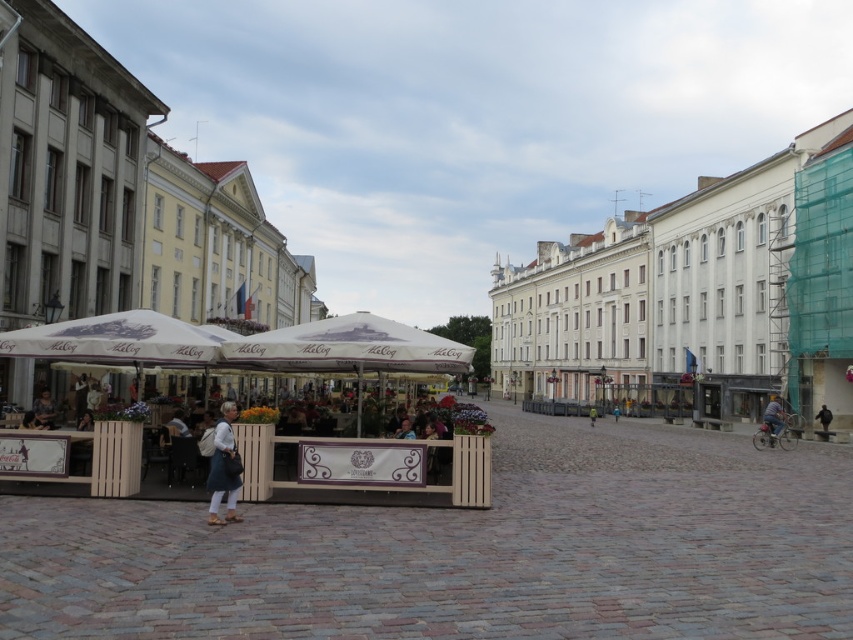
Can you confirm if white wood market at center is thinner than light blue denim jacket at lower left?

Incorrect, white wood market at center's width is not less than light blue denim jacket at lower left's.

Can you confirm if white wood market at center is positioned above light blue denim jacket at lower left?

Indeed, white wood market at center is positioned over light blue denim jacket at lower left.

Between point (416, 346) and point (227, 470), which one is positioned in front?

Point (227, 470) is more forward.

Locate an element on the screen. white wood market at center is located at coordinates (241, 344).

Between blue denim jeans at lower right and green fabric jacket at center, which one appears on the right side from the viewer's perspective?

blue denim jeans at lower right is more to the right.

Is blue denim jeans at lower right to the right of green fabric jacket at center from the viewer's perspective?

Correct, you'll find blue denim jeans at lower right to the right of green fabric jacket at center.

Between point (782, 417) and point (592, 422), which one is positioned behind?

The point (592, 422) is behind.

Locate an element on the screen. This screenshot has height=640, width=853. blue denim jeans at lower right is located at coordinates (773, 419).

Consider the image. Who is shorter, white wood market at center or white fabric canopy at center?

white fabric canopy at center is shorter.

This screenshot has width=853, height=640. I want to click on white wood market at center, so click(241, 344).

Where is `white wood market at center`? This screenshot has width=853, height=640. white wood market at center is located at coordinates pos(241,344).